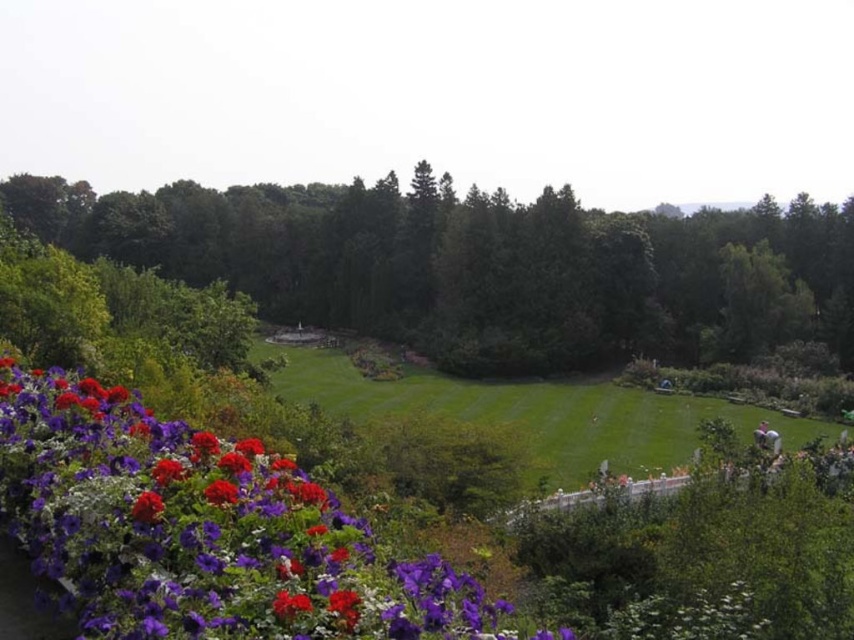
Question: Does green leafy tree at left lie in front of green grass at center?

Choices:
 (A) no
 (B) yes

Answer: (A)

Question: Which of the following is the farthest from the observer?

Choices:
 (A) green grass at center
 (B) green leafy tree at left

Answer: (B)

Question: Among these points, which one is nearest to the camera?

Choices:
 (A) (376, 396)
 (B) (521, 212)

Answer: (A)

Question: Can you confirm if green leafy tree at left is positioned to the right of purple matte flower at lower left?

Choices:
 (A) yes
 (B) no

Answer: (B)

Question: Is green leafy tree at left to the left of green grass at center from the viewer's perspective?

Choices:
 (A) yes
 (B) no

Answer: (A)

Question: Which of the following is the farthest from the observer?

Choices:
 (A) green grass at center
 (B) purple matte flower at lower left
 (C) green leafy tree at left

Answer: (C)